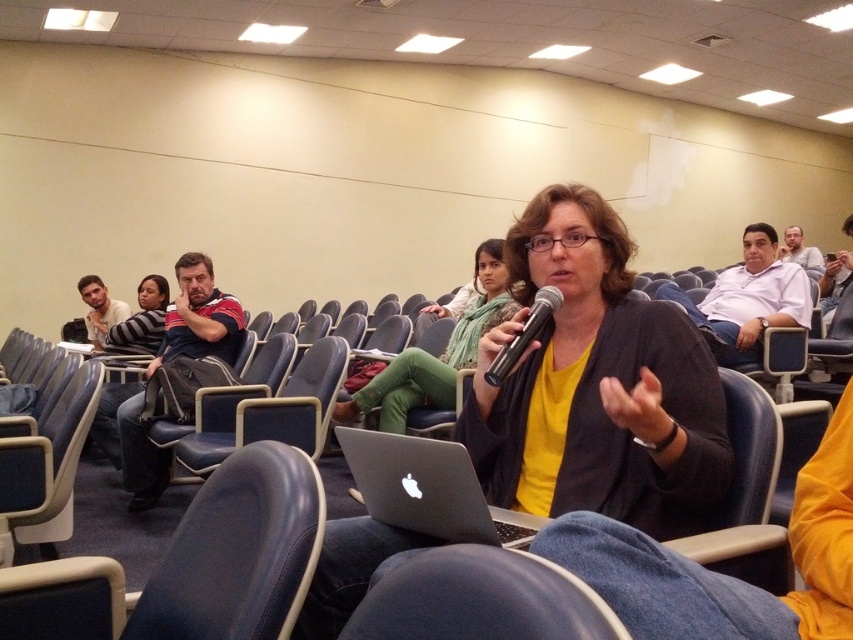
Question: Does denim at lower center have a larger size compared to matte white shirt at upper right?

Choices:
 (A) no
 (B) yes

Answer: (A)

Question: Is matte black laptop at center to the right of yellow matte sweater at center from the viewer's perspective?

Choices:
 (A) yes
 (B) no

Answer: (A)

Question: Among these points, which one is farthest from the camera?

Choices:
 (A) (560, 291)
 (B) (396, 461)

Answer: (A)

Question: Can you confirm if blue leather chair at lower left is smaller than yellow matte sweater at center?

Choices:
 (A) no
 (B) yes

Answer: (B)

Question: Which point is closer to the camera?

Choices:
 (A) matte black laptop at center
 (B) black metallic microphone at center
 (C) denim at lower center

Answer: (C)

Question: Estimate the real-world distances between objects in this image. Which object is closer to the yellow matte sweater at center?

Choices:
 (A) matte black laptop at center
 (B) silver metallic laptop at center
 (C) blue leather chair at lower left
 (D) black metallic microphone at center

Answer: (A)